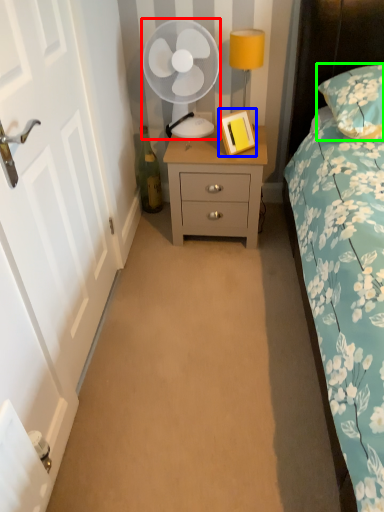
Question: Considering the real-world distances, which object is closest to mechanical fan (highlighted by a red box)? picture frame (highlighted by a blue box) or pillow (highlighted by a green box).

Choices:
 (A) picture frame
 (B) pillow

Answer: (A)